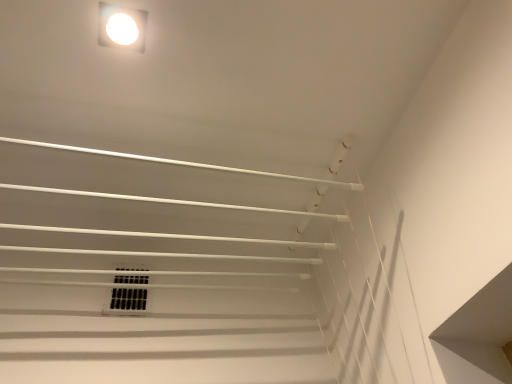
Question: Looking at the image, does black plastic vent at center seem bigger or smaller compared to white matte light fixture at upper center?

Choices:
 (A) big
 (B) small

Answer: (A)

Question: Is point (147, 281) closer or farther from the camera than point (120, 39)?

Choices:
 (A) closer
 (B) farther

Answer: (B)

Question: Considering the relative positions of black plastic vent at center and white matte light fixture at upper center in the image provided, is black plastic vent at center to the left or to the right of white matte light fixture at upper center?

Choices:
 (A) left
 (B) right

Answer: (A)

Question: In terms of height, does white matte light fixture at upper center look taller or shorter compared to black plastic vent at center?

Choices:
 (A) tall
 (B) short

Answer: (B)

Question: From a real-world perspective, relative to black plastic vent at center, is white matte light fixture at upper center vertically above or below?

Choices:
 (A) above
 (B) below

Answer: (A)

Question: From the image's perspective, is white matte light fixture at upper center located above or below black plastic vent at center?

Choices:
 (A) below
 (B) above

Answer: (B)

Question: Is white matte light fixture at upper center in front of or behind black plastic vent at center in the image?

Choices:
 (A) front
 (B) behind

Answer: (A)